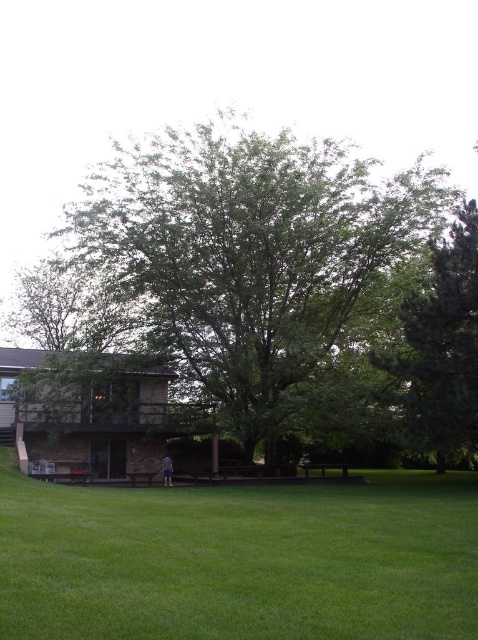
Question: Which object is the closest to the green grass at center?

Choices:
 (A) green leafy tree at center
 (B) green leafy tree at right

Answer: (B)

Question: Considering the real-world distances, which object is farthest from the green leafy tree at right?

Choices:
 (A) green grass at center
 (B) green leafy tree at center

Answer: (B)

Question: Which object is the closest to the green grass at center?

Choices:
 (A) green leafy tree at right
 (B) green leafy tree at center

Answer: (A)

Question: Does green grass at center appear over green leafy tree at right?

Choices:
 (A) yes
 (B) no

Answer: (A)

Question: Does green leafy tree at center appear on the right side of green grass at center?

Choices:
 (A) no
 (B) yes

Answer: (B)

Question: Is green grass at center above green leafy tree at right?

Choices:
 (A) no
 (B) yes

Answer: (B)